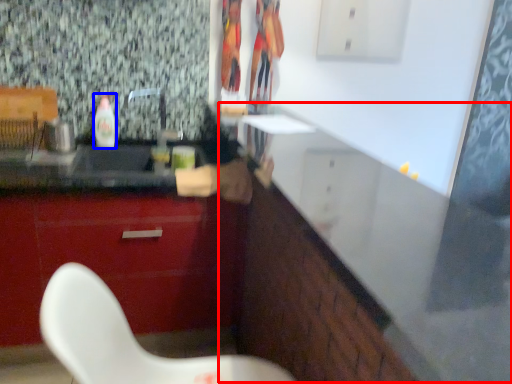
Question: Which object appears farthest to the camera in this image, counter (highlighted by a red box) or bottle (highlighted by a blue box)?

Choices:
 (A) counter
 (B) bottle

Answer: (B)